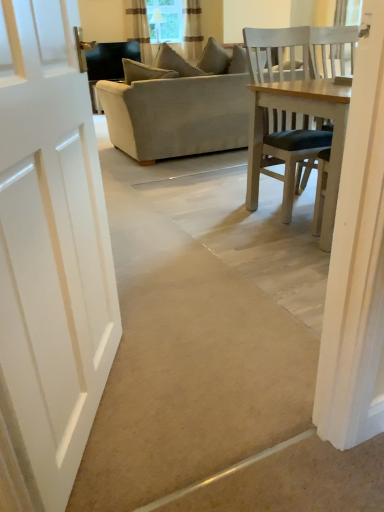
Question: Is point click(x=201, y=35) closer or farther from the camera than point click(x=140, y=38)?

Choices:
 (A) farther
 (B) closer

Answer: (B)

Question: Looking at the image, does striped fabric curtain at upper center, which ranks as the second curtain in left-to-right order, seem bigger or smaller compared to brown textured curtain at upper center, the 2th curtain when ordered from right to left?

Choices:
 (A) small
 (B) big

Answer: (A)

Question: Which is nearer to the clear glass window screen at upper center?

Choices:
 (A) beige fabric couch at center
 (B) wooden chair at right
 (C) striped fabric curtain at upper center, arranged as the 1th curtain when viewed from the right
 (D) brown textured curtain at upper center, the 2th curtain when ordered from right to left

Answer: (C)

Question: Based on their relative distances, which object is nearer to the striped fabric curtain at upper center, arranged as the 1th curtain when viewed from the right?

Choices:
 (A) beige fabric couch at center
 (B) brown textured curtain at upper center, the 2th curtain when ordered from right to left
 (C) wooden chair at right
 (D) clear glass window screen at upper center

Answer: (D)